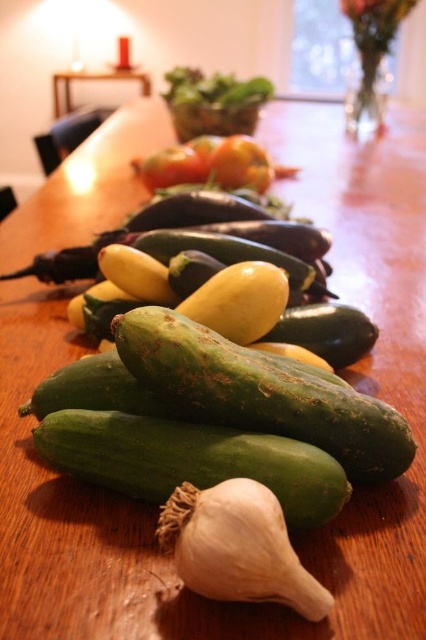
You are preparing a vegetable platter and need to know which vegetable is smaller between the green rough cucumber at center and the smooth orange squash at center. Which one should you choose?

The green rough cucumber at center has a smaller size compared to the smooth orange squash at center, so you should choose the green rough cucumber at center for the vegetable platter.